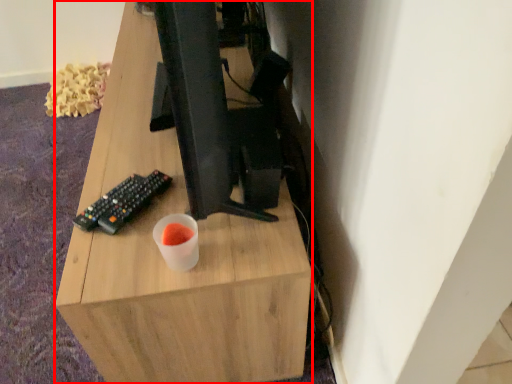
Question: From the image, what is the correct spatial relationship of desk (annotated by the red box) in relation to computer keyboard?

Choices:
 (A) right
 (B) left

Answer: (A)